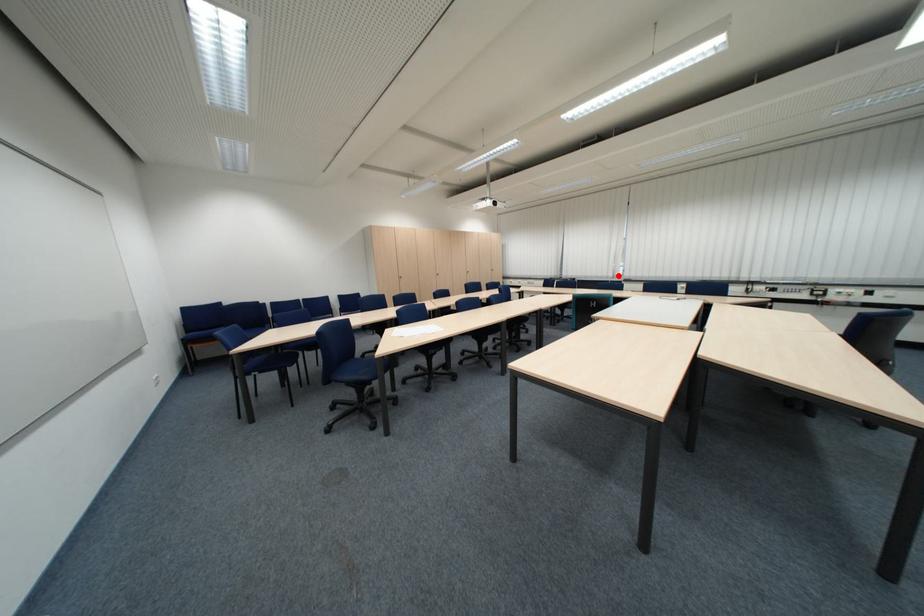
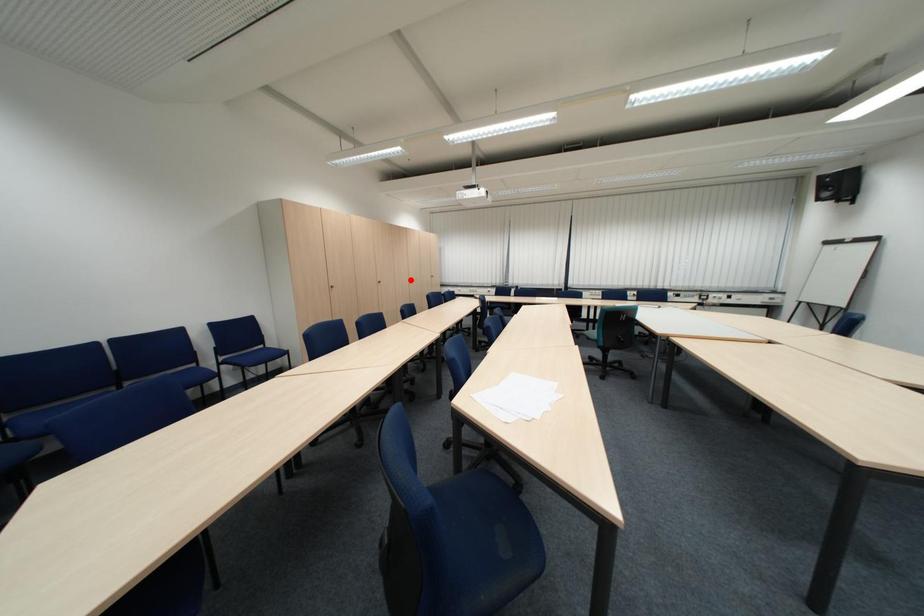
I am providing you with two images of the same scene from different viewpoints. A red point is marked on the first image and another point is marked on the second image. Is the red point in image1 aligned with the point shown in image2?

No